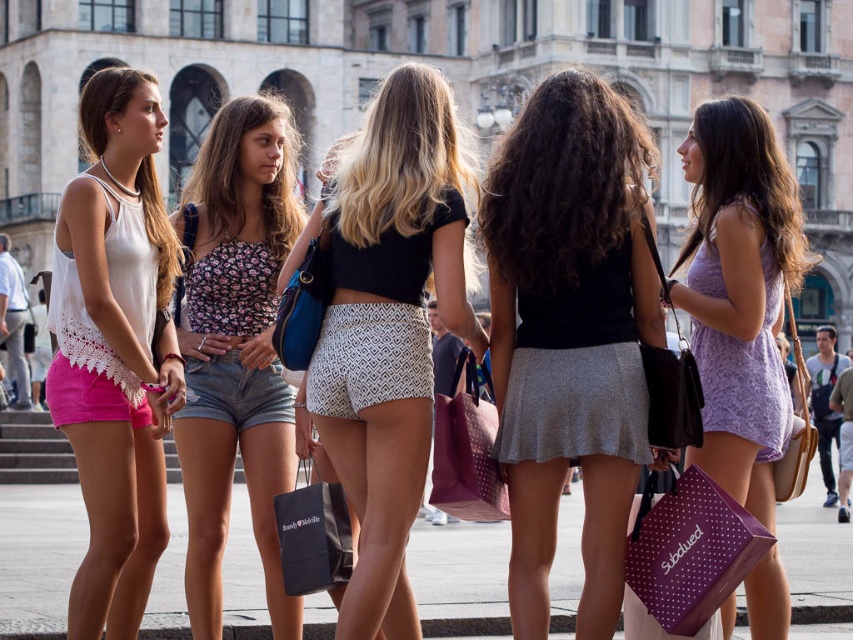
You are standing at the point closest to the ornate building in the background. Which point, point (341, 227) or point (439, 429), is closer to you?

Point (341, 227) is closer to you because it is in front of point (439, 429).

Looking at this image, you are a photographer trying to capture a candid shot of the white textured shorts at center and the lavender printed dress at right. Since you want to focus on both subjects, which one should you adjust your camera focus to prioritize to ensure both are in frame?

The white textured shorts at center is in front of the lavender printed dress at right, so you should prioritize focusing on the white textured shorts at center first to ensure both are in frame.

You are a photographer trying to capture a photo of the dark brown hair at center and the purple dotted fabric shopping bag at center. From the photographer perspective, which object is positioned to the left?

The dark brown hair at center is to the left of the purple dotted fabric shopping bag at center, so the dark brown hair at center is positioned to the left.